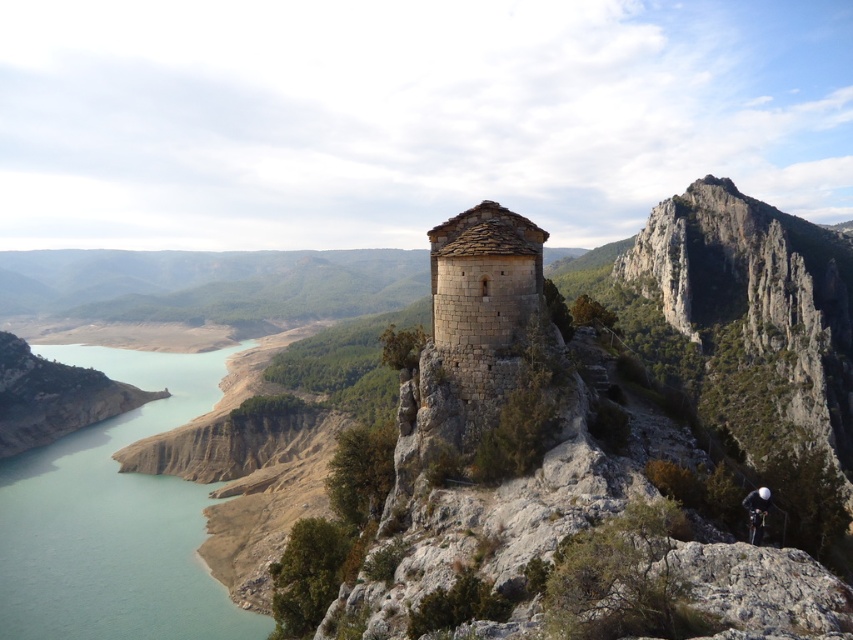
From the picture: Does turquoise water at lower left appear under stone tower at center?

Yes.

Does point (102, 349) lie behind point (445, 342)?

Yes.

You are a GUI agent. You are given a task and a screenshot of the screen. Output one action in this format:
    pyautogui.click(x=<x>, y=<y>)
    Task: Click on the turquoise water at lower left
    The image size is (853, 640).
    Given the screenshot: What is the action you would take?
    pyautogui.click(x=115, y=518)

Who is higher up, stone tower at center or black fabric helmet at center?

A: stone tower at center is higher up.

Identify the location of stone tower at center. This screenshot has height=640, width=853. (483, 304).

Locate an element on the screen. This screenshot has width=853, height=640. stone tower at center is located at coordinates (483, 304).

Which is more to the right, turquoise water at lower left or black fabric helmet at center?

black fabric helmet at center is more to the right.

Identify the location of turquoise water at lower left. (115, 518).